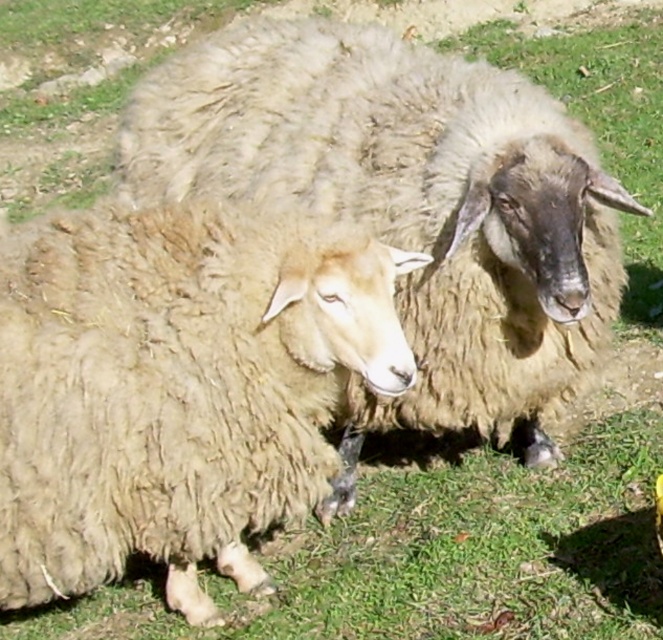
You are a shepherd trying to separate two sheep for shearing. You notice the fuzzy beige wool at center and the fuzzy woolen sheep at center. Which sheep is positioned to the right?

The fuzzy woolen sheep at center is to the right of the fuzzy beige wool at center, so the fuzzy woolen sheep at center is positioned to the right.